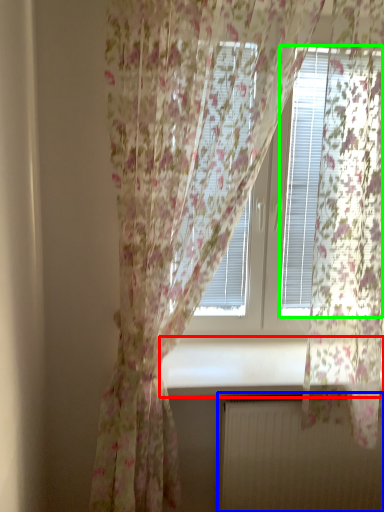
Question: Which object is positioned closest to window sill (highlighted by a red box)? Select from radiator (highlighted by a blue box) and blind (highlighted by a green box).

Choices:
 (A) radiator
 (B) blind

Answer: (A)